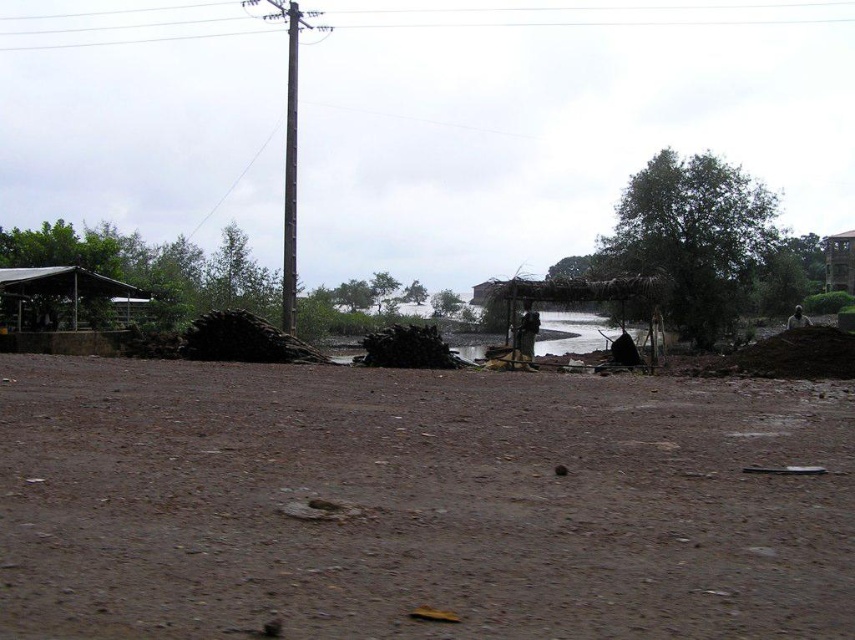
Question: Which point is farther from the camera taking this photo?

Choices:
 (A) (799, 8)
 (B) (295, 276)
 (C) (251, 3)
 (D) (158, 422)

Answer: (A)

Question: Can you confirm if brown mud at center is positioned below wooden thatched hut at right?

Choices:
 (A) yes
 (B) no

Answer: (A)

Question: Does brushed metal power line at upper center have a greater width compared to smooth gray pole at center?

Choices:
 (A) no
 (B) yes

Answer: (B)

Question: Which point is farther from the camera taking this photo?

Choices:
 (A) 293,246
 (B) 826,276

Answer: (B)

Question: Is the position of dull brown dirt at center less distant than that of brown mud at center?

Choices:
 (A) yes
 (B) no

Answer: (A)

Question: Which point is closer to the camera?

Choices:
 (A) (500, 477)
 (B) (281, 292)

Answer: (A)